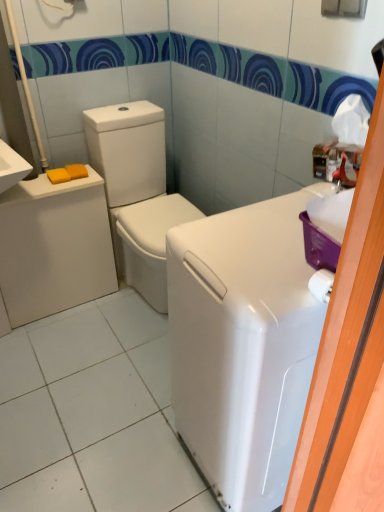
Identify the location of free region on the left part of yellow matte soap at left, positioned as the second soap in right-to-left order. The image size is (384, 512). (33, 182).